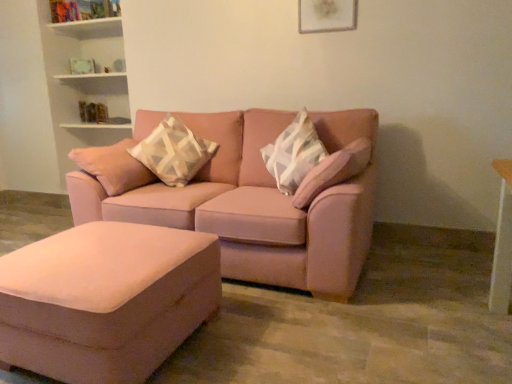
Question: From a real-world perspective, is geometric-patterned fabric pillow at center physically located above or below matte white picture frame at upper center?

Choices:
 (A) above
 (B) below

Answer: (B)

Question: Is point (178, 137) closer or farther from the camera than point (322, 18)?

Choices:
 (A) closer
 (B) farther

Answer: (B)

Question: Which object is positioned farthest from the suede ottoman at lower left?

Choices:
 (A) matte pink couch at center
 (B) matte white picture frame at upper center
 (C) geometric-patterned fabric pillow at center

Answer: (B)

Question: Which object is positioned farthest from the suede ottoman at lower left?

Choices:
 (A) matte white picture frame at upper center
 (B) geometric-patterned fabric pillow at center
 (C) matte pink couch at center

Answer: (A)